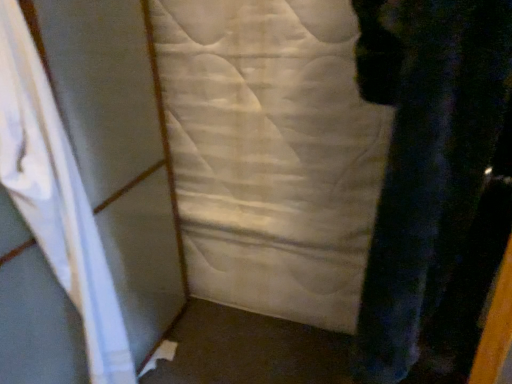
Question: Does white fabric curtain at left come behind white quilted fabric at center?

Choices:
 (A) yes
 (B) no

Answer: (B)

Question: Is white fabric curtain at left oriented towards white quilted fabric at center?

Choices:
 (A) no
 (B) yes

Answer: (A)

Question: Can you confirm if white fabric curtain at left is positioned to the right of white quilted fabric at center?

Choices:
 (A) no
 (B) yes

Answer: (A)

Question: Is white fabric curtain at left smaller than white quilted fabric at center?

Choices:
 (A) yes
 (B) no

Answer: (A)

Question: Is white quilted fabric at center at the back of white fabric curtain at left?

Choices:
 (A) yes
 (B) no

Answer: (B)

Question: From a real-world perspective, is white fabric curtain at left under white quilted fabric at center?

Choices:
 (A) yes
 (B) no

Answer: (B)

Question: Is white quilted fabric at center facing away from white fabric curtain at left?

Choices:
 (A) no
 (B) yes

Answer: (A)

Question: Can you confirm if white quilted fabric at center is smaller than white fabric curtain at left?

Choices:
 (A) no
 (B) yes

Answer: (A)

Question: Is white quilted fabric at center positioned far away from white fabric curtain at left?

Choices:
 (A) yes
 (B) no

Answer: (B)

Question: Can you confirm if white quilted fabric at center is wider than white fabric curtain at left?

Choices:
 (A) yes
 (B) no

Answer: (B)

Question: Considering the relative sizes of white quilted fabric at center and white fabric curtain at left in the image provided, is white quilted fabric at center shorter than white fabric curtain at left?

Choices:
 (A) no
 (B) yes

Answer: (B)

Question: Is the position of white quilted fabric at center more distant than that of white fabric curtain at left?

Choices:
 (A) yes
 (B) no

Answer: (A)

Question: From their relative heights in the image, would you say white quilted fabric at center is taller or shorter than white fabric curtain at left?

Choices:
 (A) short
 (B) tall

Answer: (A)